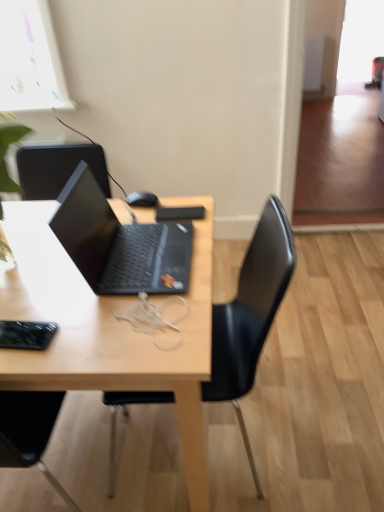
The height and width of the screenshot is (512, 384). What are the coordinates of `free space above wooden desk at center (from a real-world perspective)` in the screenshot? It's located at (99, 269).